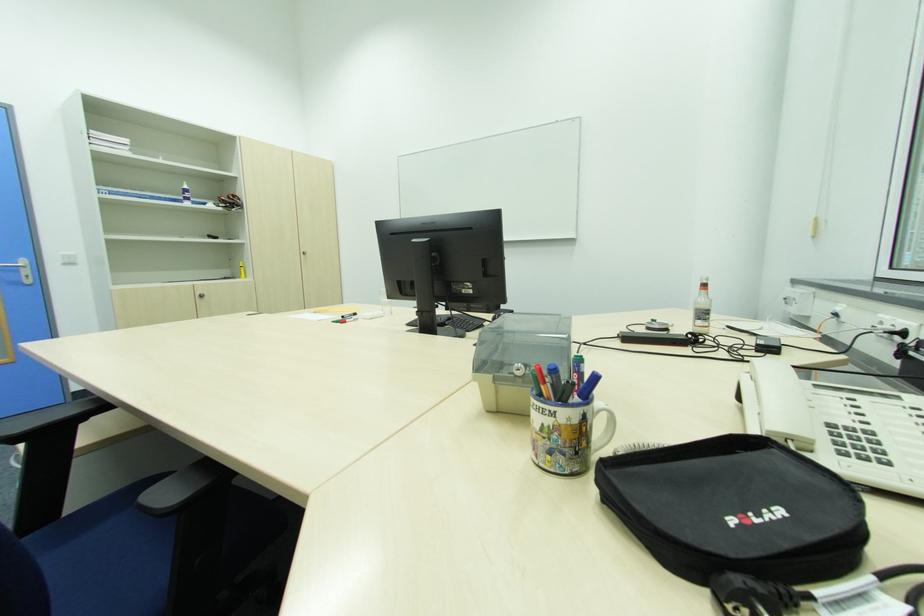
This screenshot has width=924, height=616. I want to click on black chair armrest, so click(177, 488).